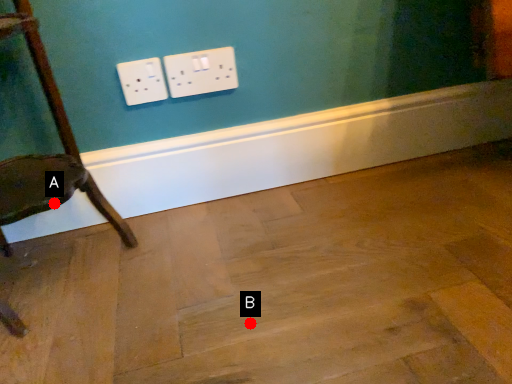
Question: Two points are circled on the image, labeled by A and B beside each circle. Which point is further to the camera?

Choices:
 (A) A is further
 (B) B is further

Answer: (A)